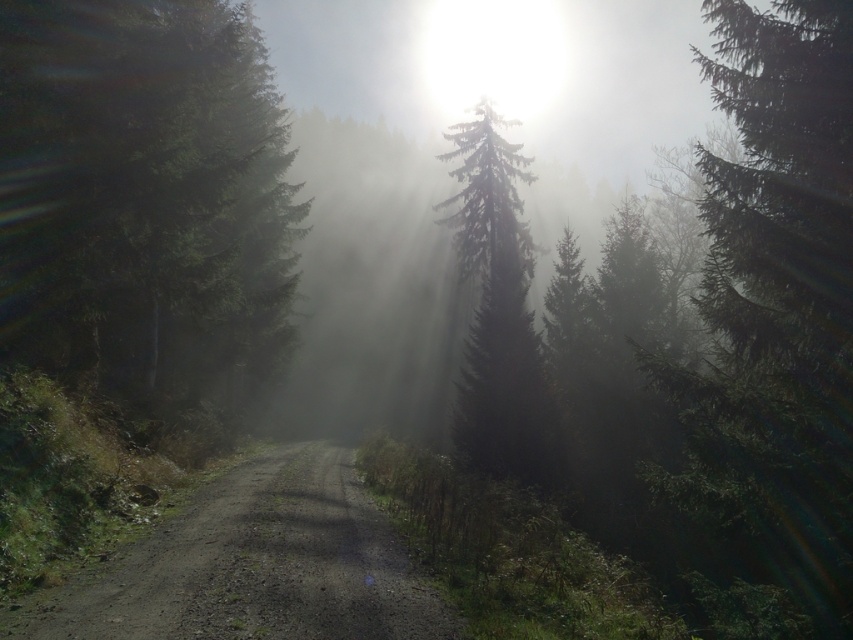
Find the location of a particular element. Image resolution: width=853 pixels, height=640 pixels. green matte tree at left is located at coordinates [144, 202].

Image resolution: width=853 pixels, height=640 pixels. What do you see at coordinates (144, 202) in the screenshot? I see `green matte tree at left` at bounding box center [144, 202].

Image resolution: width=853 pixels, height=640 pixels. I want to click on green matte tree at left, so click(144, 202).

At what (x,y) coordinates should I click in order to perform the action: click on green matte tree at left. Please return your answer as a coordinate pair (x, y). The height and width of the screenshot is (640, 853). Looking at the image, I should click on (144, 202).

Who is positioned more to the right, green matte tree at left or dirt/gravel road at center?

Positioned to the right is dirt/gravel road at center.

Locate an element on the screen. This screenshot has height=640, width=853. green matte tree at left is located at coordinates (144, 202).

Where is `green matte tree at left`? green matte tree at left is located at coordinates (144, 202).

Find the location of a particular element. This screenshot has height=640, width=853. green matte tree at left is located at coordinates (144, 202).

Can you confirm if dirt/gravel road at center is bigger than green matte tree at center?

No, dirt/gravel road at center is not bigger than green matte tree at center.

Does dirt/gravel road at center have a lesser width compared to green matte tree at center?

Yes, dirt/gravel road at center is thinner than green matte tree at center.

At what (x,y) coordinates should I click in order to perform the action: click on dirt/gravel road at center. Please return your answer as a coordinate pair (x, y). This screenshot has height=640, width=853. Looking at the image, I should click on (253, 566).

Locate an element on the screen. dirt/gravel road at center is located at coordinates 253,566.